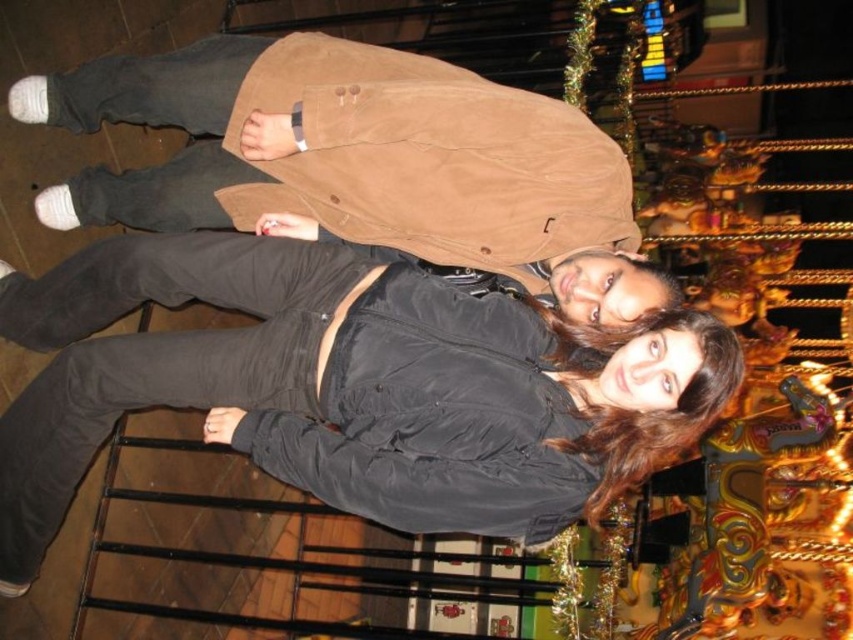
Does matte black jacket at center appear on the right side of black matte jacket at center?

No, matte black jacket at center is not to the right of black matte jacket at center.

You are a GUI agent. You are given a task and a screenshot of the screen. Output one action in this format:
    pyautogui.click(x=<x>, y=<y>)
    Task: Click on the matte black jacket at center
    
    Given the screenshot: What is the action you would take?
    pyautogui.click(x=344, y=388)

Is point (473, 518) positioned before point (630, 413)?

Yes, point (473, 518) is in front of point (630, 413).

You are a GUI agent. You are given a task and a screenshot of the screen. Output one action in this format:
    pyautogui.click(x=<x>, y=<y>)
    Task: Click on the matte black jacket at center
    The width and height of the screenshot is (853, 640).
    Given the screenshot: What is the action you would take?
    pyautogui.click(x=344, y=388)